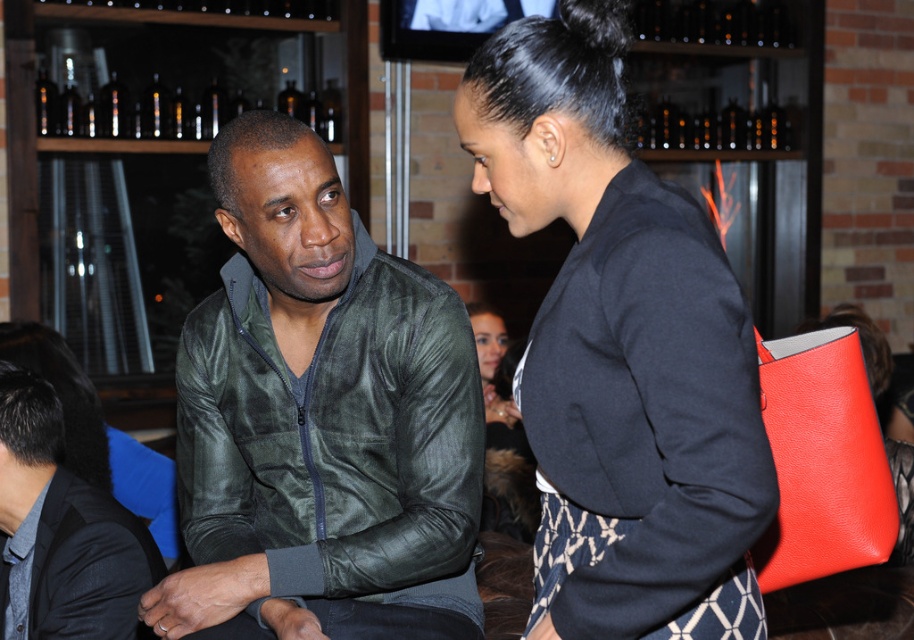
Can you confirm if green leather jacket at center is positioned to the left of matte black jacket at center?

Yes, green leather jacket at center is to the left of matte black jacket at center.

Between point (320, 193) and point (508, 376), which one is positioned behind?

The point (508, 376) is behind.

Measure the distance between green leather jacket at center and camera.

They are 1.58 meters apart.

The width and height of the screenshot is (914, 640). What are the coordinates of `green leather jacket at center` in the screenshot? It's located at (319, 420).

Is black woolen blazer at upper center wider than dark gray textured jacket at lower left?

Indeed, black woolen blazer at upper center has a greater width compared to dark gray textured jacket at lower left.

Between point (649, 624) and point (48, 387), which one is positioned behind?

Point (48, 387)

What are the coordinates of `black woolen blazer at upper center` in the screenshot? It's located at (622, 349).

Can you confirm if dark gray textured jacket at lower left is wider than matte black jacket at center?

Correct, the width of dark gray textured jacket at lower left exceeds that of matte black jacket at center.

Who is higher up, dark gray textured jacket at lower left or matte black jacket at center?

matte black jacket at center is above.

Is point (36, 612) behind point (509, 496)?

No.

Locate an element on the screen. The height and width of the screenshot is (640, 914). dark gray textured jacket at lower left is located at coordinates (60, 531).